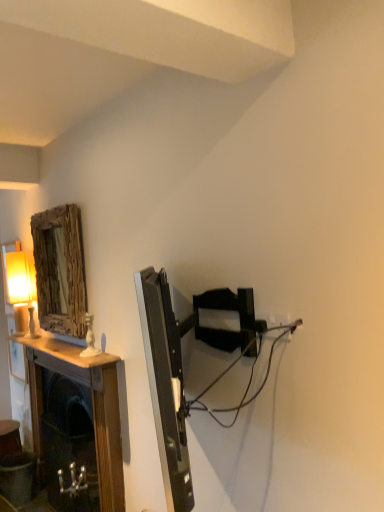
Question: From the image's perspective, is black plastic cable at center right positioned above or below wooden textured mirror at upper left?

Choices:
 (A) above
 (B) below

Answer: (B)

Question: Considering the positions of black plastic cable at center right and wooden textured mirror at upper left in the image, is black plastic cable at center right bigger or smaller than wooden textured mirror at upper left?

Choices:
 (A) small
 (B) big

Answer: (A)

Question: Estimate the real-world distances between objects in this image. Which object is farther from the wooden textured mirror at upper left?

Choices:
 (A) black plastic cable at center right
 (B) matte cream table lamp at left
 (C) wooden mantel at left

Answer: (A)

Question: Which object is the farthest from the wooden textured mirror at upper left?

Choices:
 (A) black plastic cable at center right
 (B) wooden mantel at left
 (C) matte cream table lamp at left

Answer: (A)